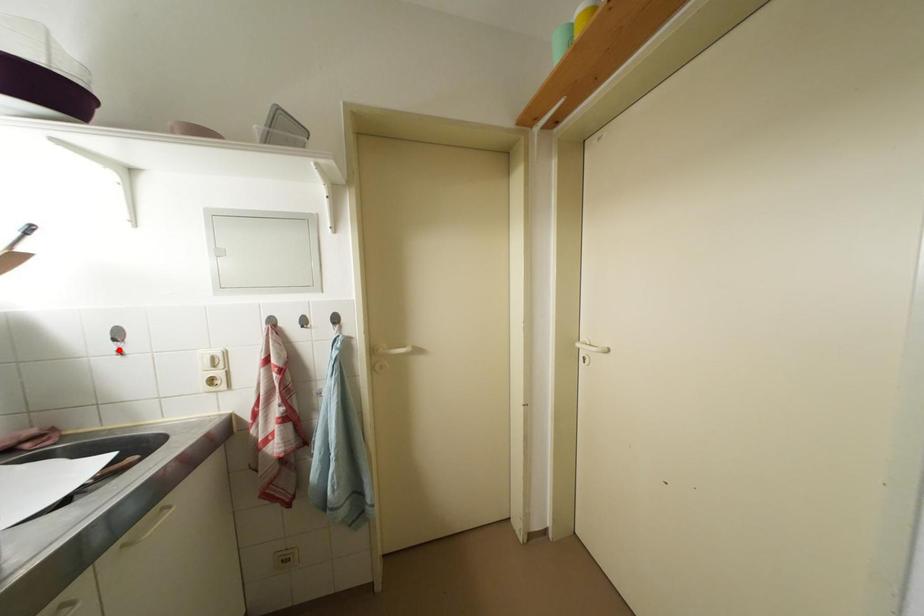
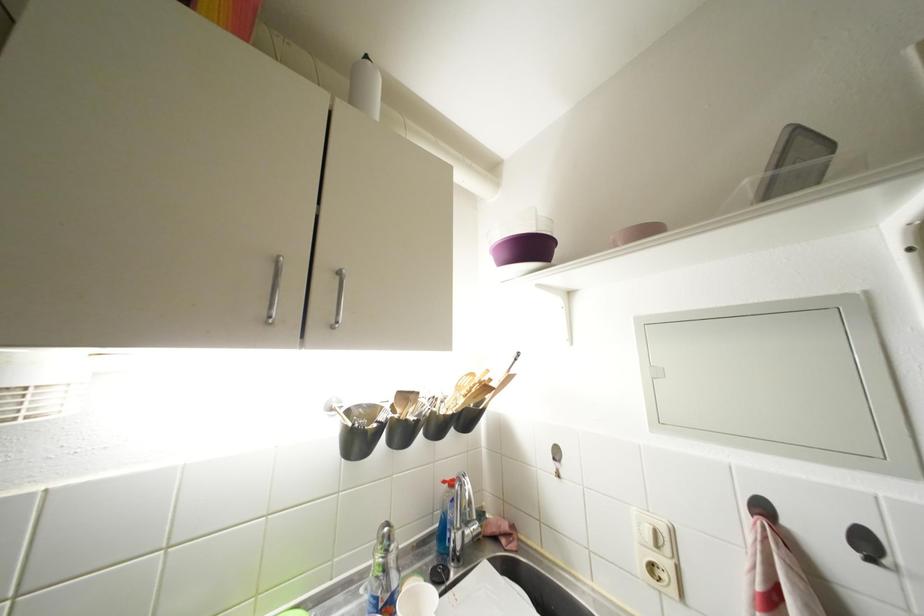
In the second image, find the point that corresponds to the highlighted location in the first image.

(560, 469)